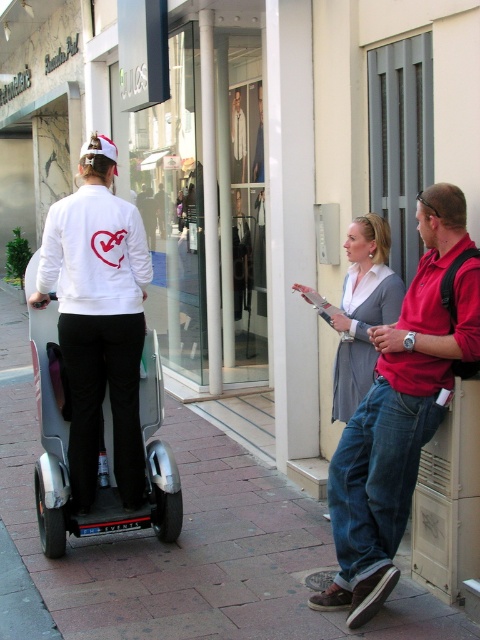
Question: Does red shirt at right have a lesser width compared to silver metallic scooter at left?

Choices:
 (A) no
 (B) yes

Answer: (B)

Question: Which is farther from the silver metallic scooter at left?

Choices:
 (A) matte gray coat at center
 (B) red shirt at right
 (C) brick pavement at center

Answer: (B)

Question: Among these objects, which one is nearest to the camera?

Choices:
 (A) matte gray coat at center
 (B) brick pavement at center

Answer: (B)

Question: Which point is farther to the camera?

Choices:
 (A) brick pavement at center
 (B) red shirt at right
 (C) matte gray coat at center

Answer: (C)

Question: Is brick pavement at center to the right of matte gray coat at center from the viewer's perspective?

Choices:
 (A) yes
 (B) no

Answer: (B)

Question: Can you confirm if silver metallic scooter at left is smaller than matte gray coat at center?

Choices:
 (A) no
 (B) yes

Answer: (A)